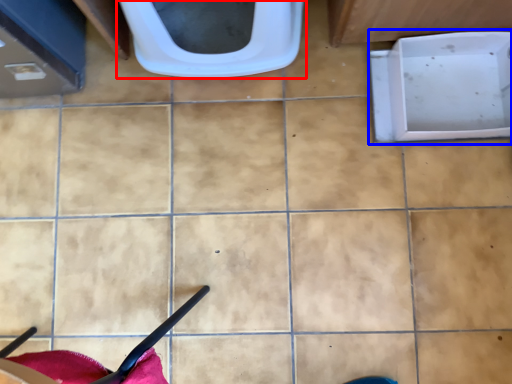
Question: Which of the following is the closest to the observer, toilet (highlighted by a red box) or bath (highlighted by a blue box)?

Choices:
 (A) toilet
 (B) bath

Answer: (A)